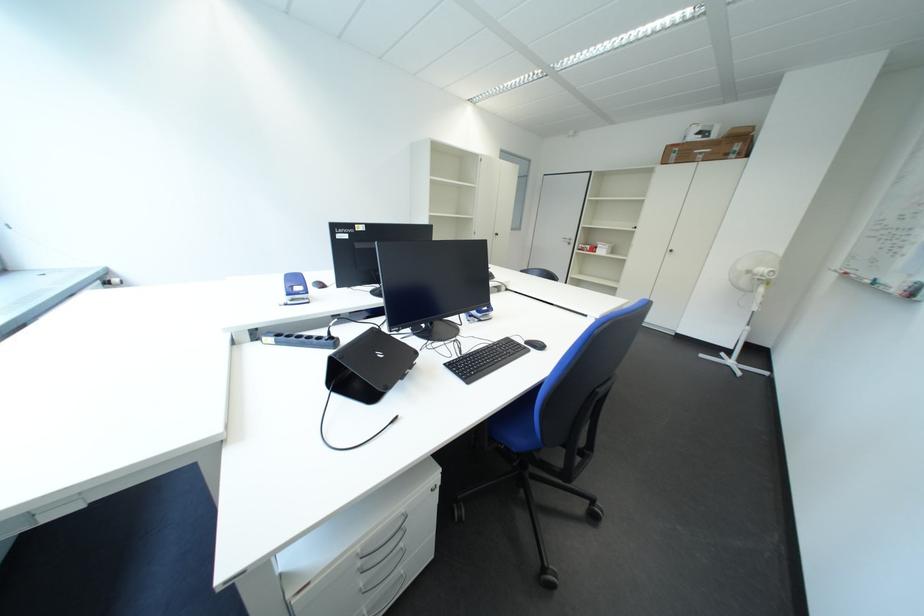
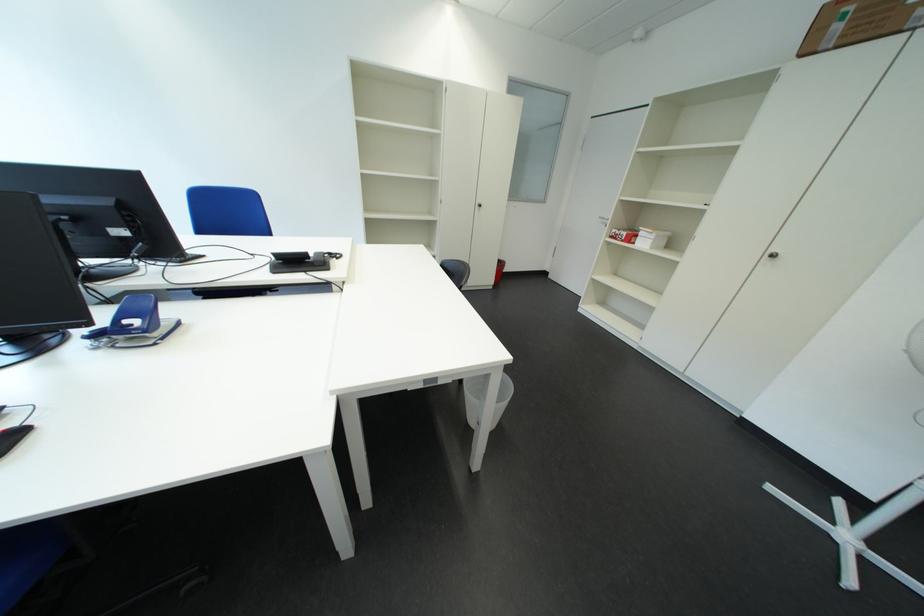
Where in the second image is the point corresponding to point 686,158 from the first image?

(849, 30)